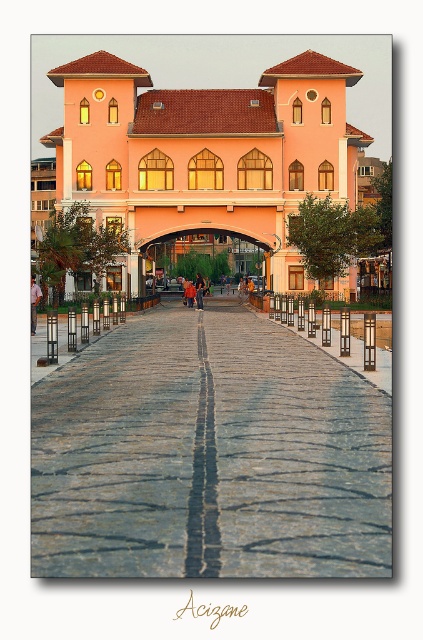
Who is positioned more to the left, gray cobblestone pavement at center or matte pink dress at center?

matte pink dress at center

At what (x,y) coordinates should I click in order to perform the action: click on gray cobblestone pavement at center. Please return your answer as a coordinate pair (x, y). Image resolution: width=423 pixels, height=640 pixels. Looking at the image, I should click on (208, 456).

Which is behind, point (35, 304) or point (195, 280)?

Point (195, 280)

Does matte pink dress at center appear under orange fabric person at center?

Yes, matte pink dress at center is below orange fabric person at center.

Image resolution: width=423 pixels, height=640 pixels. What do you see at coordinates (33, 304) in the screenshot?
I see `matte pink dress at center` at bounding box center [33, 304].

Where is `matte pink dress at center`? The image size is (423, 640). matte pink dress at center is located at coordinates (33, 304).

Between gray cobblestone pavement at center and orange fabric person at center, which one appears on the left side from the viewer's perspective?

orange fabric person at center is more to the left.

Is point (173, 390) positioned after point (200, 284)?

No, it is in front of (200, 284).

Find the location of a particular element. The image size is (423, 640). gray cobblestone pavement at center is located at coordinates (208, 456).